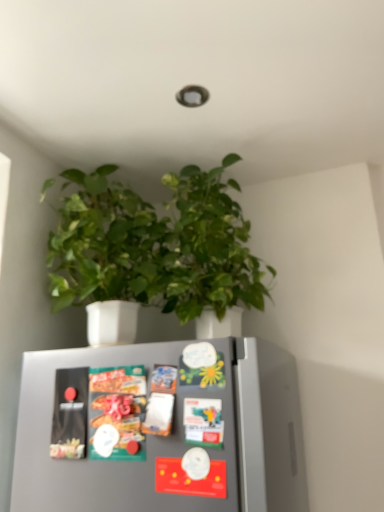
Question: Relative to green matte plant at upper center, is matte plastic snack packet at center in front or behind?

Choices:
 (A) behind
 (B) front

Answer: (B)

Question: Is matte plastic snack packet at center to the left or to the right of green matte plant at upper center in the image?

Choices:
 (A) left
 (B) right

Answer: (A)

Question: Considering the real-world distances, which object is closest to the metallic silver fridge magnets at center?

Choices:
 (A) green matte plant at upper center
 (B) matte plastic snack packet at center

Answer: (B)

Question: Based on their relative distances, which object is nearer to the metallic silver fridge magnets at center?

Choices:
 (A) matte plastic snack packet at center
 (B) green matte plant at upper center

Answer: (A)